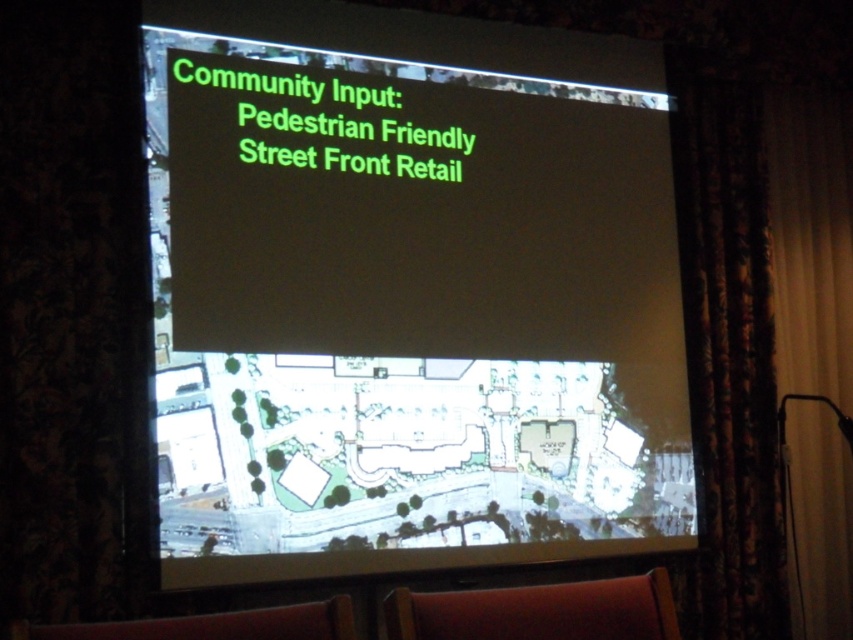
You are an urban planner attending a community meeting. You need to present a detailed plan on the white paper at center. Where should you place your hand to pick it up without obstructing the projected slide? Please provide coordinates in the format of x,y where x and y are between 0 and 1.

The white paper at center is located at point [409,292]. To pick it up without obstructing the projected slide, place your hand near the edges of the paper, such as at coordinates [409,292] plus or minus a small margin. Ensure your hand does not cover the main content area of the slide.

You are sitting in the red leather armchair at lower center and want to move to the brown leather armchair at lower center. Can you do so without climbing over any furniture?

The red leather armchair at lower center is below the brown leather armchair at lower center, so you would need to climb over or move around the furniture to reach it.